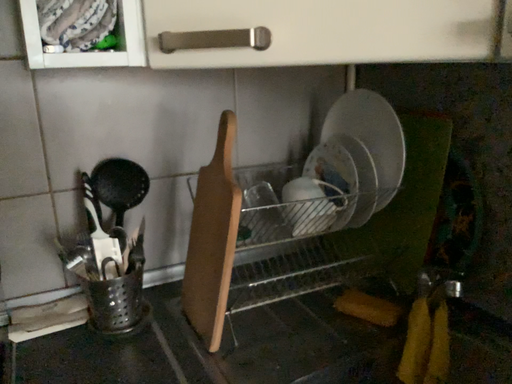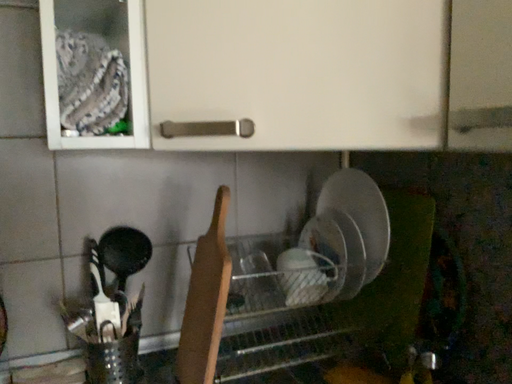
Question: Which way did the camera rotate in the video?

Choices:
 (A) rotated upward
 (B) rotated downward

Answer: (A)